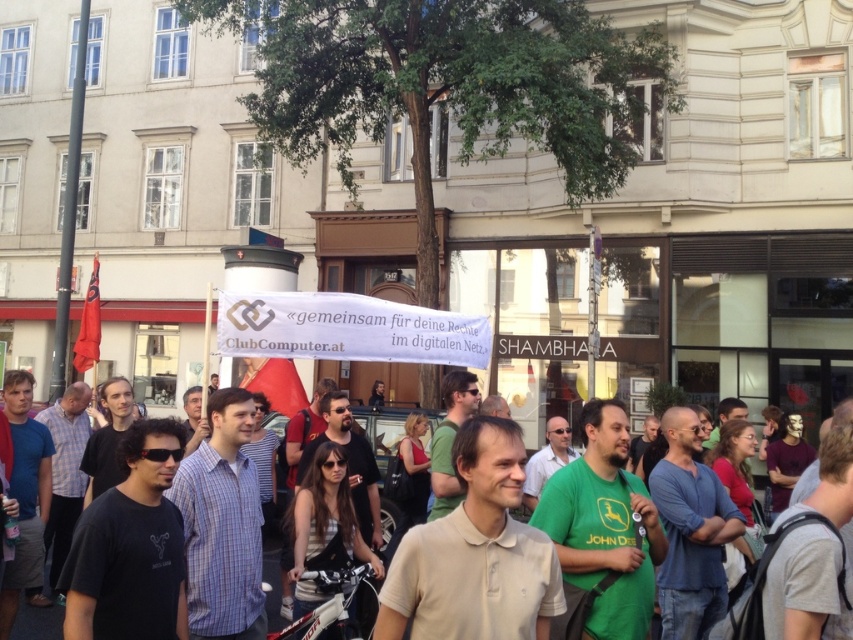
Question: Which point is farther to the camera?

Choices:
 (A) light beige polo shirt at center
 (B) white fabric banner at center

Answer: (B)

Question: Does white fabric banner at center lie in front of light beige polo shirt at center?

Choices:
 (A) no
 (B) yes

Answer: (A)

Question: Can you confirm if white fabric banner at center is bigger than light beige polo shirt at center?

Choices:
 (A) no
 (B) yes

Answer: (A)

Question: Does white fabric banner at center appear on the left side of light beige polo shirt at center?

Choices:
 (A) yes
 (B) no

Answer: (A)